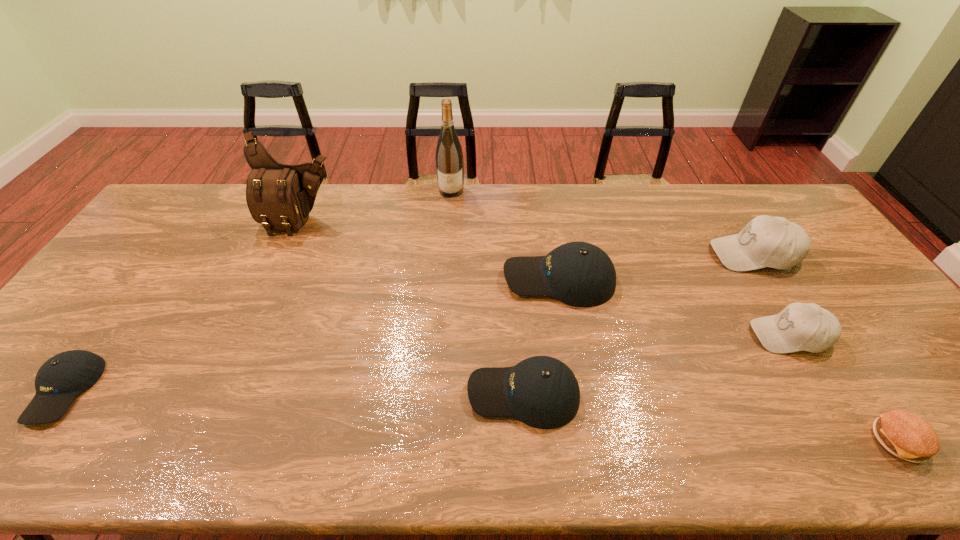
Where is `baseball cap situated at the right edge`? This screenshot has height=540, width=960. baseball cap situated at the right edge is located at coordinates (766, 241).

The width and height of the screenshot is (960, 540). What are the coordinates of `hamburger that is at the right edge` in the screenshot? It's located at [x=905, y=435].

Locate an element on the screen. object that is at the near left corner is located at coordinates (63, 377).

The width and height of the screenshot is (960, 540). Find the location of `object present at the near right corner`. object present at the near right corner is located at coordinates (905, 435).

Find the location of a particular element. The width and height of the screenshot is (960, 540). vacant space at the far edge of the desktop is located at coordinates (406, 208).

The image size is (960, 540). In the image, there is a desktop. Find the location of `vacant space at the near edge`. vacant space at the near edge is located at coordinates (885, 450).

Locate an element on the screen. vacant space at the left edge of the desktop is located at coordinates (112, 291).

Image resolution: width=960 pixels, height=540 pixels. Find the location of `vacant area between the leftmost blue baseball cap and the nearer gray baseball cap`. vacant area between the leftmost blue baseball cap and the nearer gray baseball cap is located at coordinates (427, 362).

You are a GUI agent. You are given a task and a screenshot of the screen. Output one action in this format:
    pyautogui.click(x=<x>, y=<y>)
    Task: Click on the free spot between the farthest blue baseball cap and the bigger gray baseball cap
    This screenshot has width=960, height=540.
    Given the screenshot: What is the action you would take?
    pyautogui.click(x=656, y=267)

The width and height of the screenshot is (960, 540). In order to click on free point between the second biggest blue baseball cap and the nearer gray baseball cap in this screenshot , I will do (x=657, y=364).